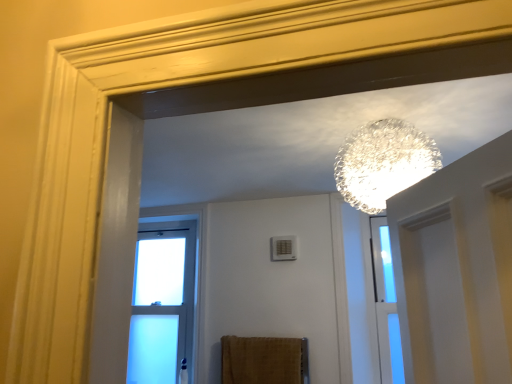
Question: From the image's perspective, does clear glass sphere at upper center appear higher than clear glass window at center?

Choices:
 (A) yes
 (B) no

Answer: (A)

Question: Can you confirm if clear glass sphere at upper center is smaller than clear glass window at center?

Choices:
 (A) no
 (B) yes

Answer: (A)

Question: Is clear glass sphere at upper center to the left of clear glass window at center from the viewer's perspective?

Choices:
 (A) no
 (B) yes

Answer: (A)

Question: Is clear glass sphere at upper center oriented towards clear glass window at center?

Choices:
 (A) no
 (B) yes

Answer: (A)

Question: Is clear glass sphere at upper center not near clear glass window at center?

Choices:
 (A) no
 (B) yes

Answer: (B)

Question: Considering the relative positions of clear glass sphere at upper center and clear glass window at center in the image provided, is clear glass sphere at upper center behind clear glass window at center?

Choices:
 (A) yes
 (B) no

Answer: (B)

Question: Is brown textured towel at lower center outside of clear glass sphere at upper center?

Choices:
 (A) no
 (B) yes

Answer: (B)

Question: Would you say clear glass sphere at upper center is part of brown textured towel at lower center's contents?

Choices:
 (A) no
 (B) yes

Answer: (A)

Question: Is the surface of brown textured towel at lower center in direct contact with clear glass sphere at upper center?

Choices:
 (A) no
 (B) yes

Answer: (A)

Question: From a real-world perspective, is brown textured towel at lower center on clear glass sphere at upper center?

Choices:
 (A) yes
 (B) no

Answer: (B)

Question: Is brown textured towel at lower center to the right of clear glass sphere at upper center from the viewer's perspective?

Choices:
 (A) yes
 (B) no

Answer: (B)

Question: Considering the relative positions of brown textured towel at lower center and clear glass sphere at upper center in the image provided, is brown textured towel at lower center to the left of clear glass sphere at upper center from the viewer's perspective?

Choices:
 (A) yes
 (B) no

Answer: (A)

Question: From a real-world perspective, is clear glass sphere at upper center located beneath brown textured towel at lower center?

Choices:
 (A) no
 (B) yes

Answer: (A)